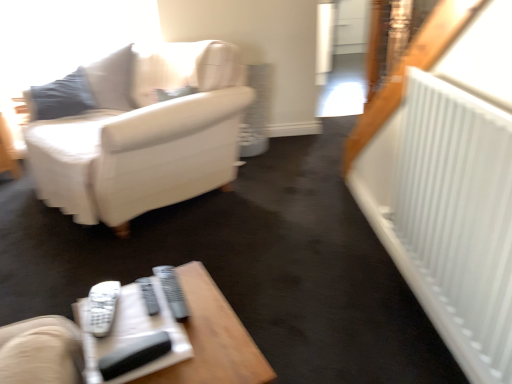
Locate an element on the screen. The image size is (512, 384). empty space that is to the right of white leather couch at upper left is located at coordinates (300, 212).